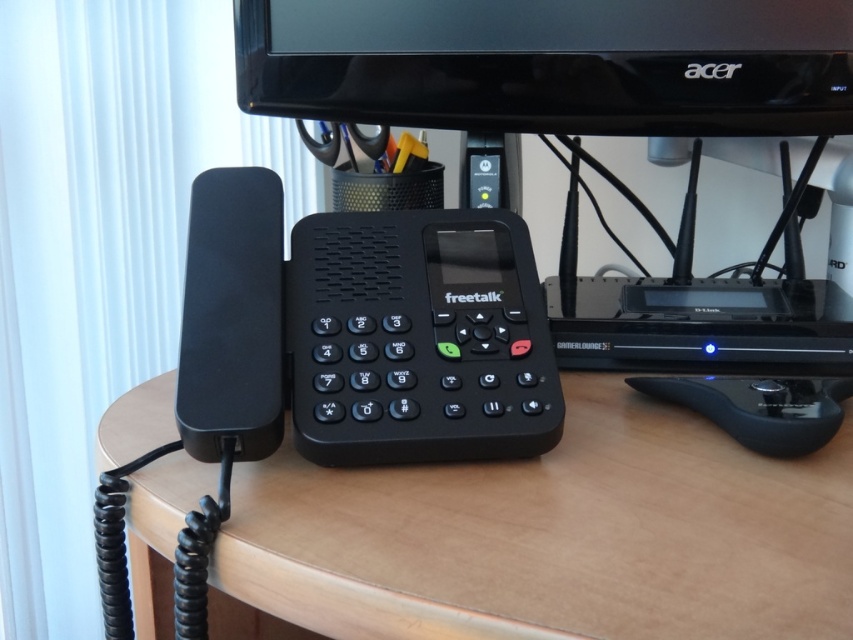
You have a small toy car that is 4 inches long. You want to place it between the wooden at center and the black matte speaker at left. Will it fit without overlapping either object?

The wooden at center is 5.07 inches away from the black matte speaker at left. Since the toy car is 4 inches long, it will fit between them without overlapping either object.

You are setting up a desk and need to place a tall plant between the wooden at center and the black matte speaker at left. Which side of the speaker should you place it to ensure it fits vertically?

The wooden at center is much taller than the black matte speaker at left, so placing the tall plant next to the speaker on the side closer to the wooden at center would allow it to fit vertically.

You are setting up a new wireless speaker and want to place it on the desk so that it is exactly halfway between the black matte speaker at left and the pen holder behind the telephone. The desk is 1.2 meters long. Can you determine the placement position for the new speaker?

The black matte speaker at left and the pen holder behind the telephone are 35.57 centimeters apart. To place the new speaker exactly halfway between them, measure 17.785 centimeters from either object. Since the desk is 1.2 meters long, there is sufficient space to position the new speaker midway between the two existing items.